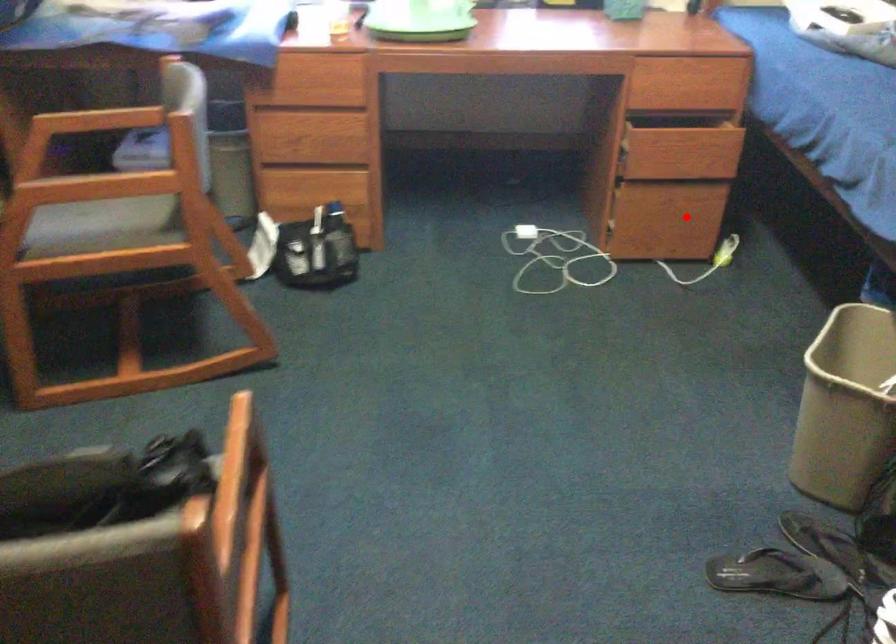
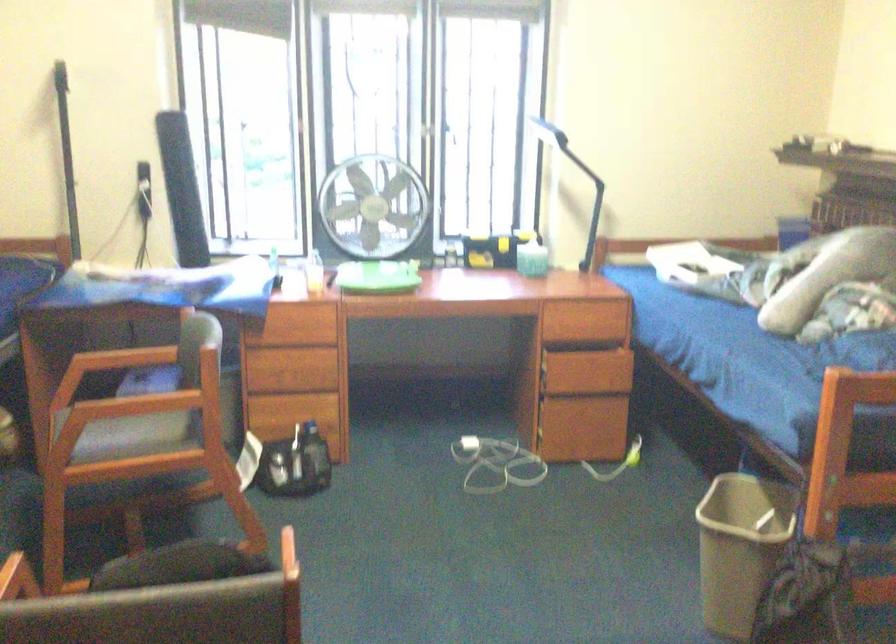
Question: I am providing you with two images of the same scene from different viewpoints. Given a red point in image1, look at the same physical point in image2. Is it:

Choices:
 (A) Closer to the viewpoint
 (B) Farther from the viewpoint

Answer: (B)